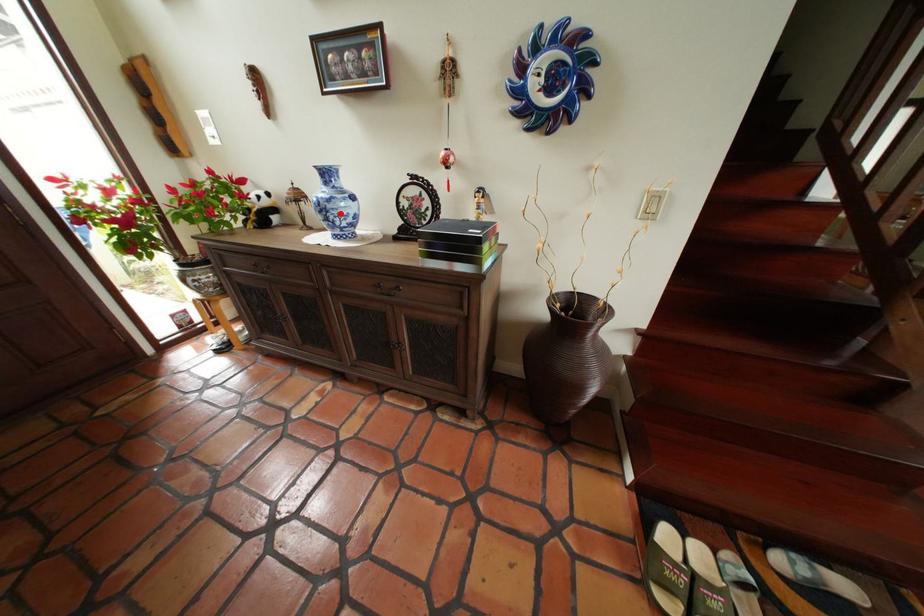
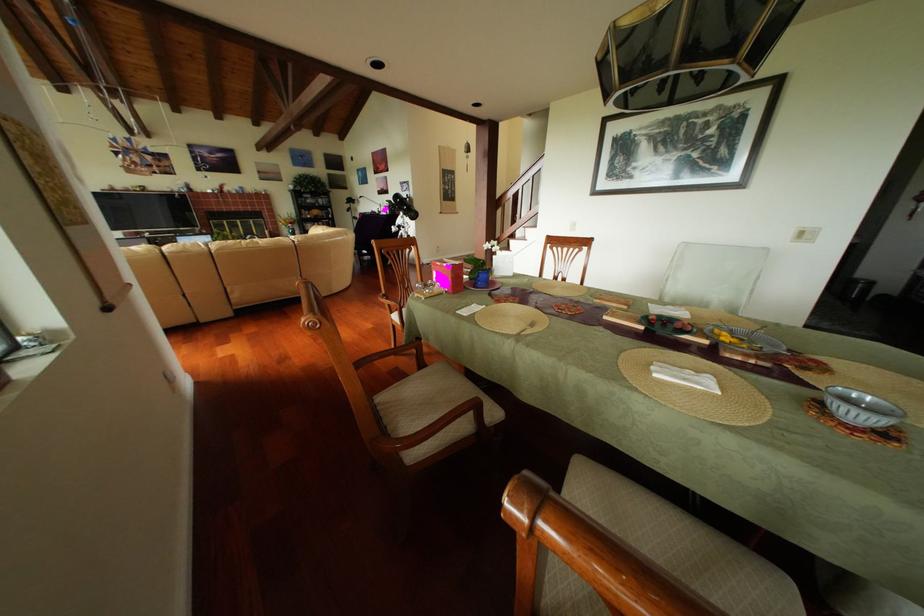
Question: I am providing you with two images of the same scene from different viewpoints. A red point is marked on the first image. Can you still see the location of the red point in image 2?

Choices:
 (A) Yes
 (B) No

Answer: (B)